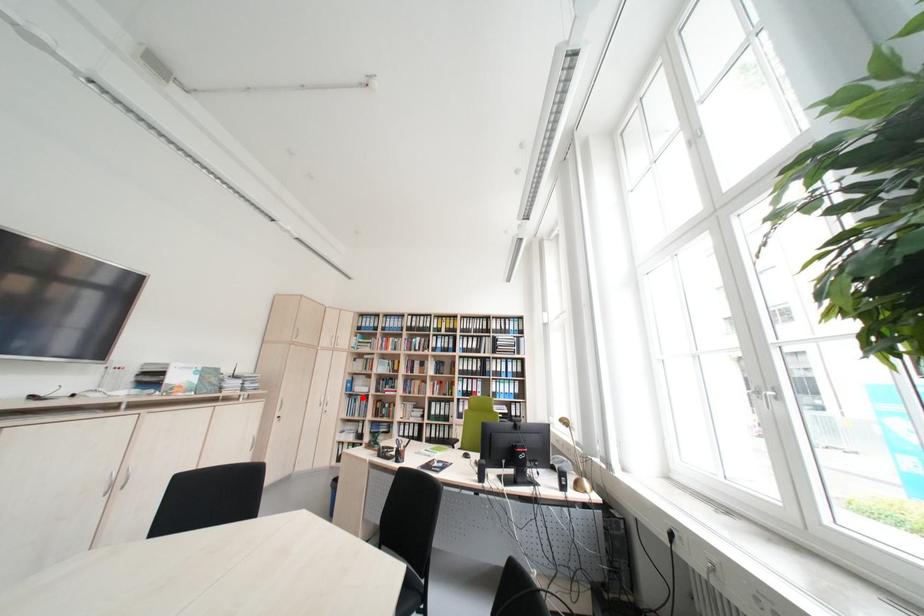
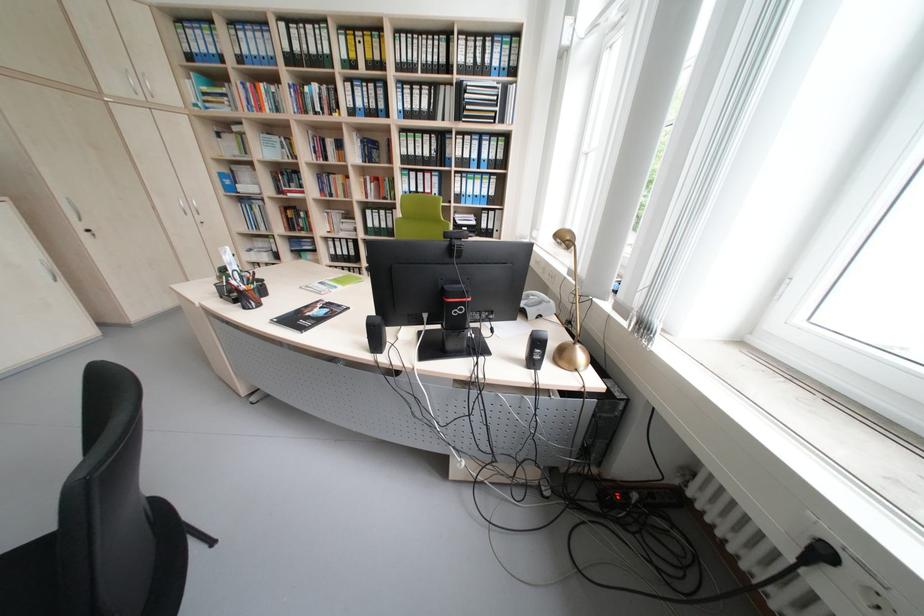
In the second image, find the point that corresponds to the highlighted location in the first image.

(253, 201)